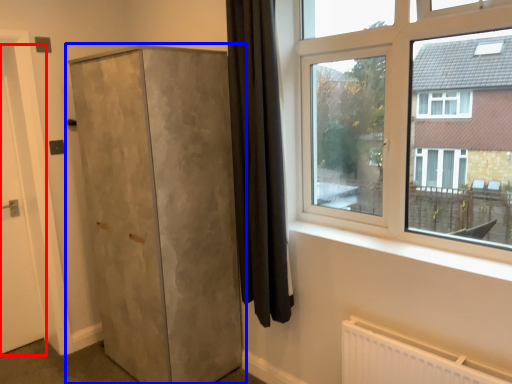
Question: Which point is further to the camera, door (highlighted by a red box) or cupboard (highlighted by a blue box)?

Choices:
 (A) door
 (B) cupboard

Answer: (A)